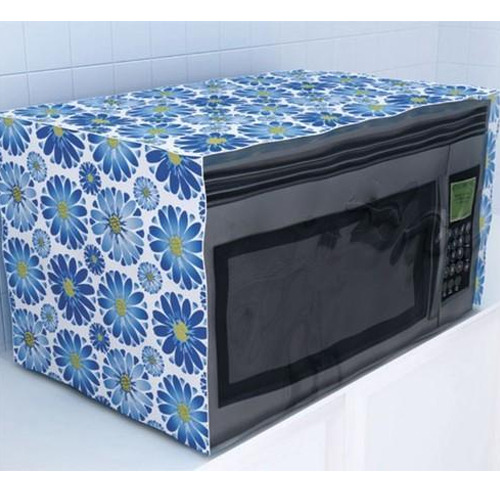
I want to click on front of microwave, so click(382, 193).